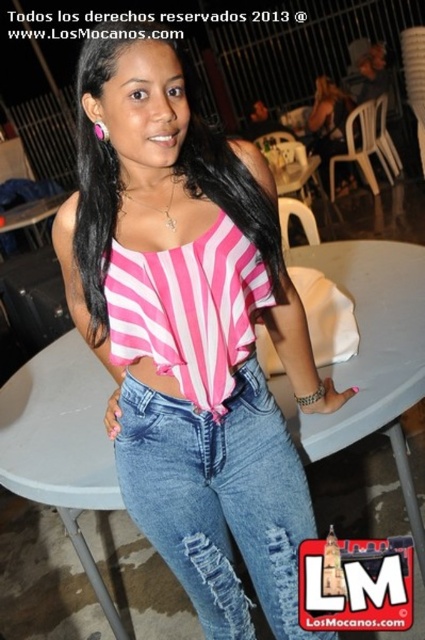
Question: Which is farther from the denim jeans at center?

Choices:
 (A) pink striped fabric top at center
 (B) ripped denim jeans at center
 (C) pink striped fabric at center

Answer: (C)

Question: Does pink striped fabric at center have a greater width compared to denim jeans at center?

Choices:
 (A) no
 (B) yes

Answer: (B)

Question: Is ripped denim jeans at center wider than pink striped fabric at center?

Choices:
 (A) no
 (B) yes

Answer: (B)

Question: Considering the real-world distances, which object is closest to the pink striped fabric top at center?

Choices:
 (A) ripped denim jeans at center
 (B) denim jeans at center
 (C) pink striped fabric at center

Answer: (A)

Question: Which object is the farthest from the ripped denim jeans at center?

Choices:
 (A) pink striped fabric top at center
 (B) pink striped fabric at center
 (C) denim jeans at center

Answer: (B)

Question: Can you confirm if pink striped fabric top at center is positioned above denim jeans at center?

Choices:
 (A) no
 (B) yes

Answer: (B)